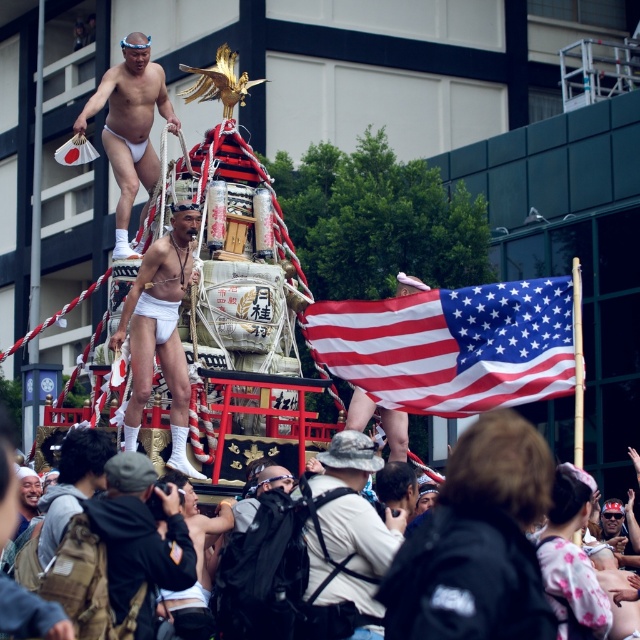
Question: Can you confirm if american flag at right is positioned below camouflage fabric backpack at center?

Choices:
 (A) yes
 (B) no

Answer: (B)

Question: Which point is closer to the camera?

Choices:
 (A) (141, 42)
 (B) (96, 445)

Answer: (B)

Question: Does camouflage fabric backpack at center have a lesser width compared to white matte underwear at center?

Choices:
 (A) no
 (B) yes

Answer: (B)

Question: Estimate the real-world distances between objects in this image. Which object is closer to the white matte underwear at center?

Choices:
 (A) white matte underwear at upper center
 (B) camouflage uniform at lower center
 (C) camouflage fabric backpack at center
 (D) black leather jacket at lower center

Answer: (A)

Question: Which point is farther to the camera?

Choices:
 (A) (374, 328)
 (B) (112, 120)
 (C) (534, 580)
 (D) (323, 588)

Answer: (B)

Question: Can you confirm if white matte underwear at upper center is positioned to the right of black leather jacket at lower center?

Choices:
 (A) no
 (B) yes

Answer: (B)